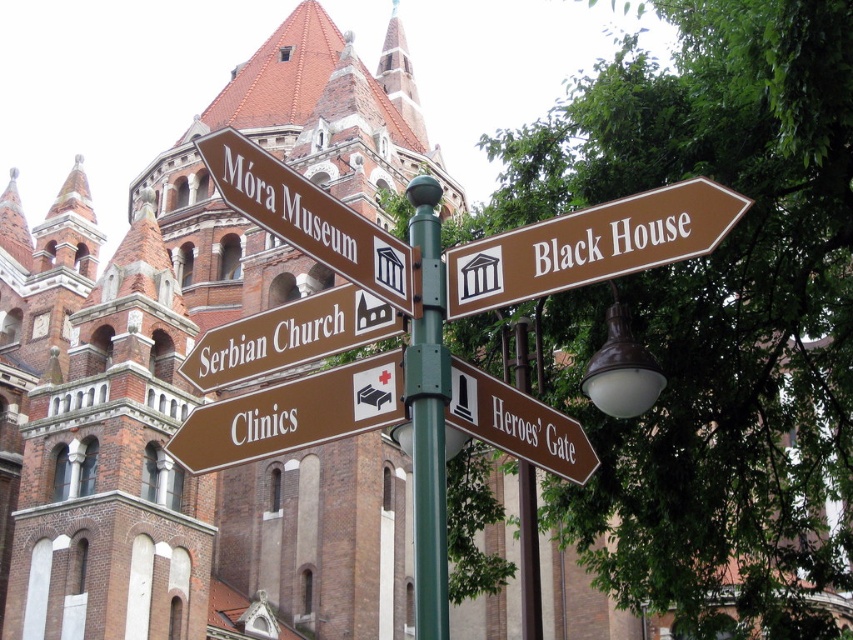
What is the name of the building depicted at the coordinates point (190,385)?

The point (190,385) indicates a brown brick church at upper center.

What are the coordinates of the brown brick church at upper center?

The coordinates of the brown brick church at upper center are at point (190, 385).